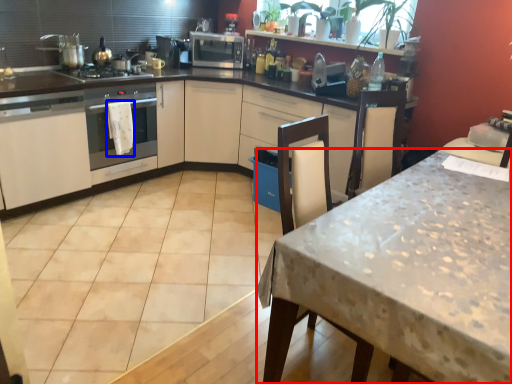
Question: Which point is further to the camera, table (highlighted by a red box) or blanket (highlighted by a blue box)?

Choices:
 (A) table
 (B) blanket

Answer: (B)